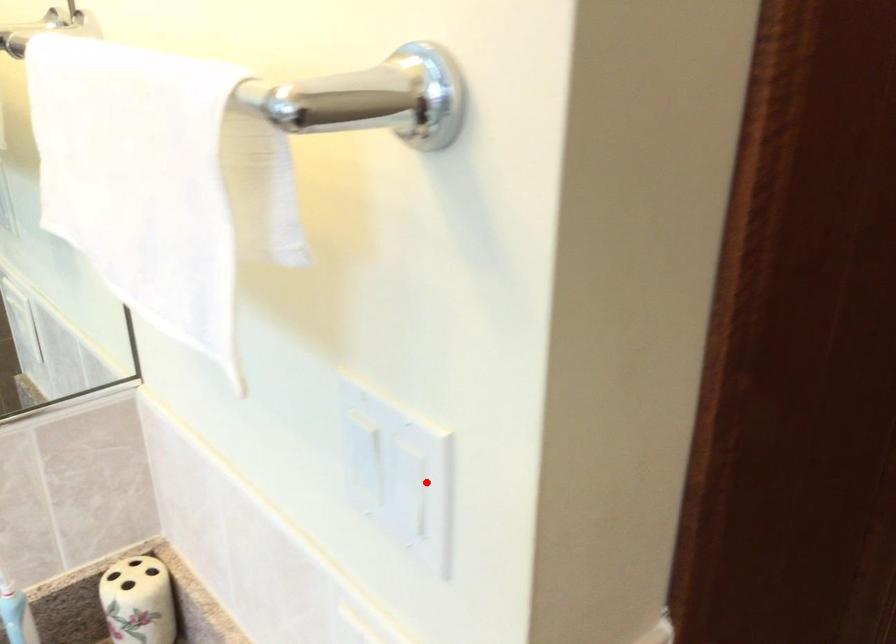
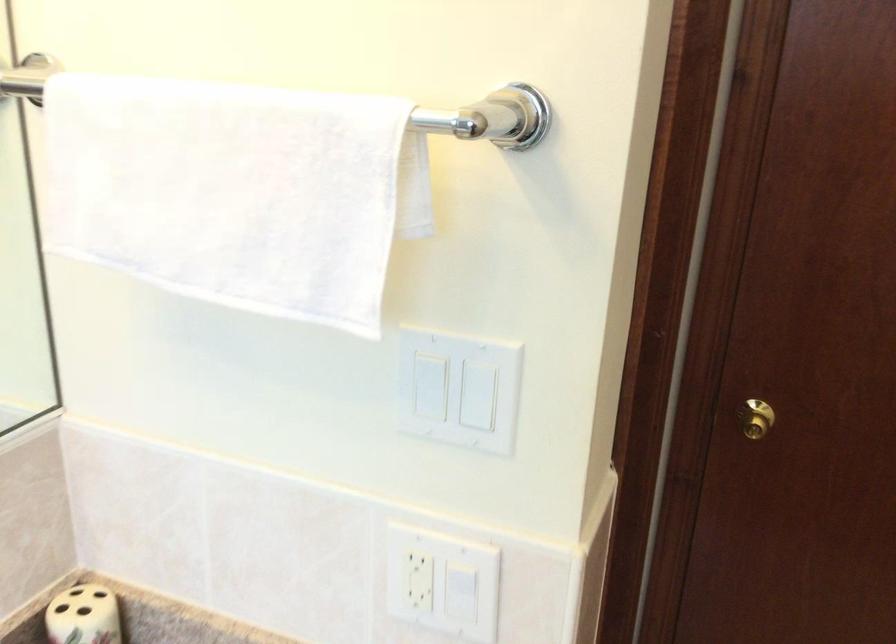
Question: I am providing you with two images of the same scene from different viewpoints. A red point is shown in image1. For the corresponding object point in image2, is it positioned nearer or farther from the camera?

Choices:
 (A) Nearer
 (B) Farther

Answer: (B)